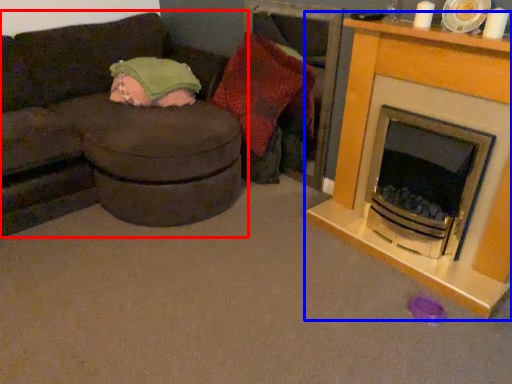
Question: Which object appears farthest to the camera in this image, studio couch (highlighted by a red box) or fireplace (highlighted by a blue box)?

Choices:
 (A) studio couch
 (B) fireplace

Answer: (B)